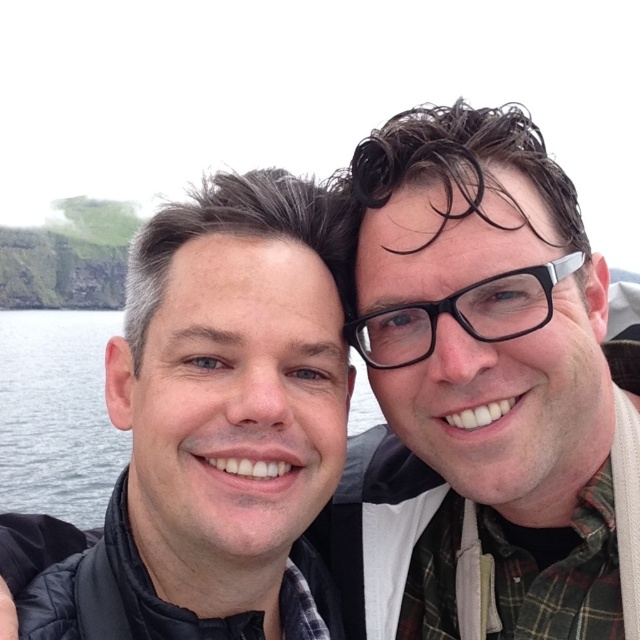
Does matte black jacket at left have a smaller size compared to black plastic glasses at right?

Incorrect, matte black jacket at left is not smaller in size than black plastic glasses at right.

Is point (216, 298) more distant than point (477, 333)?

No, it is in front of (477, 333).

Is point (300, 515) positioned in front of point (486, 323)?

No, it is not.

I want to click on matte black jacket at left, so click(230, 390).